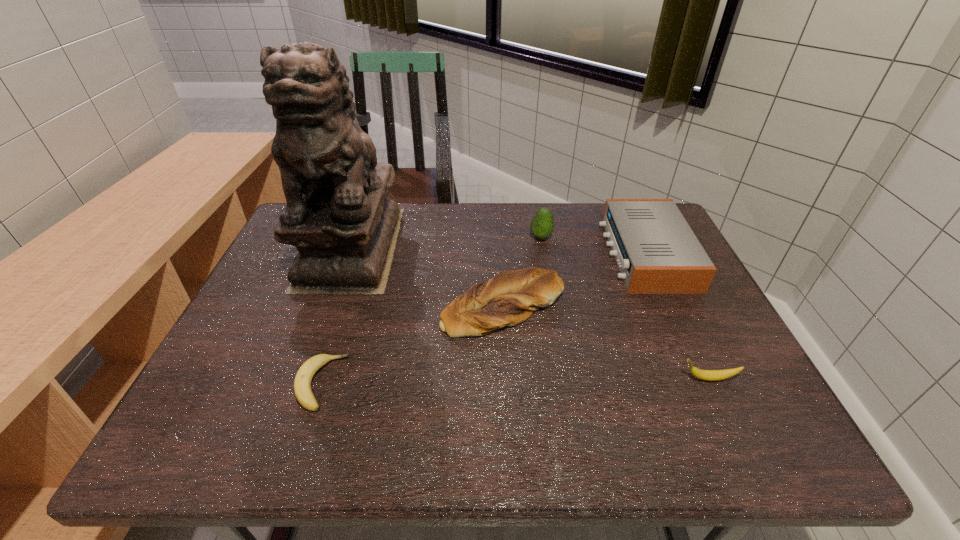
The image size is (960, 540). I want to click on sculpture, so click(338, 215).

The image size is (960, 540). What are the coordinates of `avocado` in the screenshot? It's located at (542, 224).

Find the location of a particular element. This screenshot has height=540, width=960. radio receiver is located at coordinates (657, 252).

Where is `bread`? Image resolution: width=960 pixels, height=540 pixels. bread is located at coordinates (509, 298).

The height and width of the screenshot is (540, 960). In order to click on the taller banana in this screenshot , I will do `click(708, 375)`.

You are a GUI agent. You are given a task and a screenshot of the screen. Output one action in this format:
    pyautogui.click(x=<x>, y=<y>)
    Task: Click on the right banana
    
    Given the screenshot: What is the action you would take?
    pyautogui.click(x=708, y=375)

The width and height of the screenshot is (960, 540). Identify the location of the shorter banana. (302, 384).

The width and height of the screenshot is (960, 540). What are the coordinates of `the shortest object` in the screenshot? It's located at (302, 384).

The width and height of the screenshot is (960, 540). What are the coordinates of `free space located 0.130m on the front-facing side of the sculpture` in the screenshot? It's located at (321, 333).

Where is `vacant area situated on the left of the avocado`? Image resolution: width=960 pixels, height=540 pixels. vacant area situated on the left of the avocado is located at coordinates (x=427, y=238).